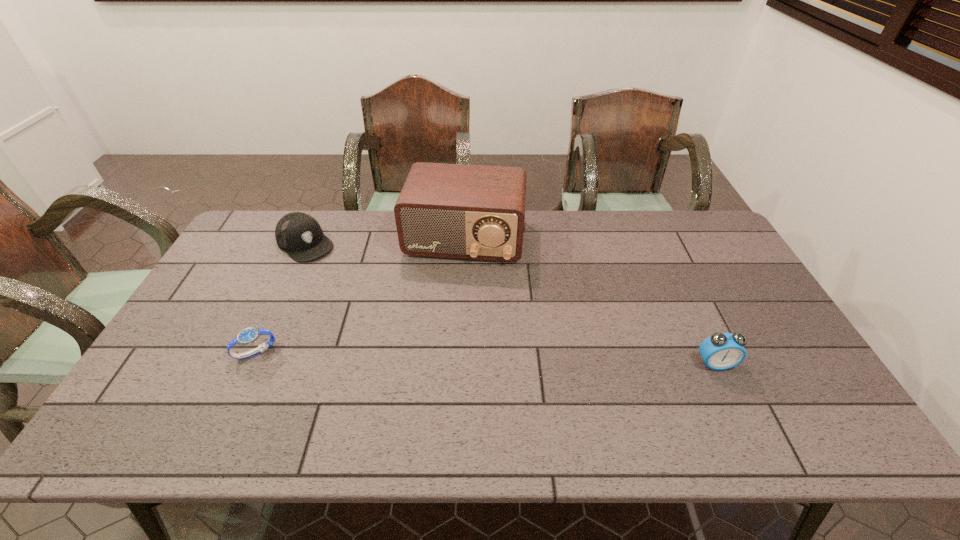
You are a GUI agent. You are given a task and a screenshot of the screen. Output one action in this format:
    pyautogui.click(x=<x>, y=<y>)
    Task: Click on the free space on the desktop that is between the shortest object and the alarm clock and is positioned on the front-facing side of the cap
    The height and width of the screenshot is (540, 960).
    Given the screenshot: What is the action you would take?
    pyautogui.click(x=419, y=356)

Identify the location of free space on the desktop that is between the shortest object and the alarm clock and is positioned on the front panel of the tallest object. The height and width of the screenshot is (540, 960). (442, 357).